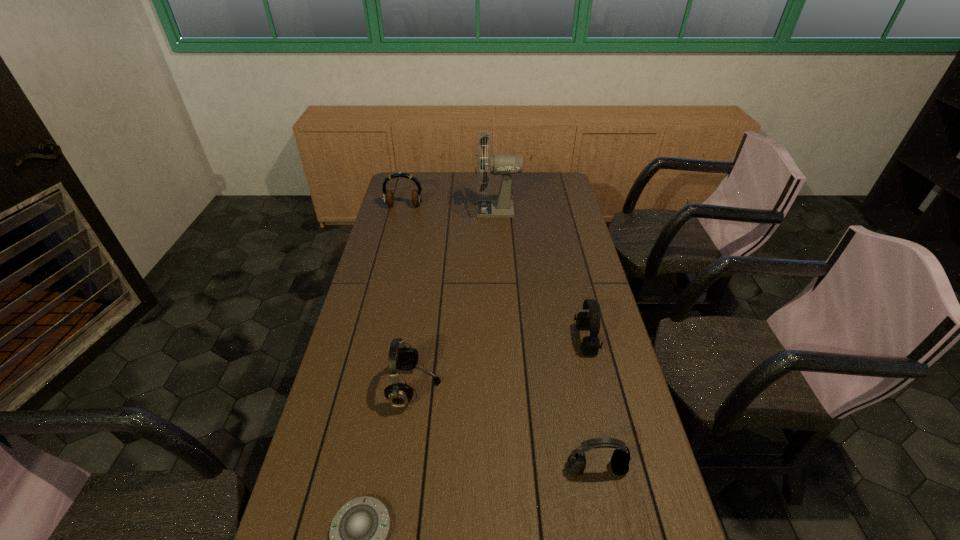
Identify the location of vacant region located with the microphone on the side of the third farthest headset. The height and width of the screenshot is (540, 960). point(500,387).

Identify the location of vacant space located on the ear cup of the farthest headset. Image resolution: width=960 pixels, height=540 pixels. (390, 264).

The image size is (960, 540). I want to click on blank space located 0.380m on the headband of the third farthest object, so click(456, 340).

Where is `vacant space located on the headband of the third farthest object`? The height and width of the screenshot is (540, 960). vacant space located on the headband of the third farthest object is located at coordinates (528, 340).

You are a GUI agent. You are given a task and a screenshot of the screen. Output one action in this format:
    pyautogui.click(x=<x>, y=<y>)
    Task: Click on the free space located 0.080m on the headband of the third farthest object
    
    Given the screenshot: What is the action you would take?
    [550, 340]

The height and width of the screenshot is (540, 960). Identify the location of free space located 0.120m on the headband of the second nearest object. (609, 530).

You are a GUI agent. You are given a task and a screenshot of the screen. Output one action in this format:
    pyautogui.click(x=<x>, y=<y>)
    Task: Click on the object at the far edge
    The image size is (960, 540).
    Given the screenshot: What is the action you would take?
    pyautogui.click(x=505, y=165)

The height and width of the screenshot is (540, 960). In order to click on object that is at the left edge in this screenshot , I will do point(388,197).

In the image, there is a desktop. At what (x,y) coordinates should I click in order to perform the action: click on vacant area at the far edge. Please return your answer as a coordinate pair (x, y). This screenshot has width=960, height=540. Looking at the image, I should click on (490, 180).

Identify the location of free space at the left edge of the desktop. (380, 387).